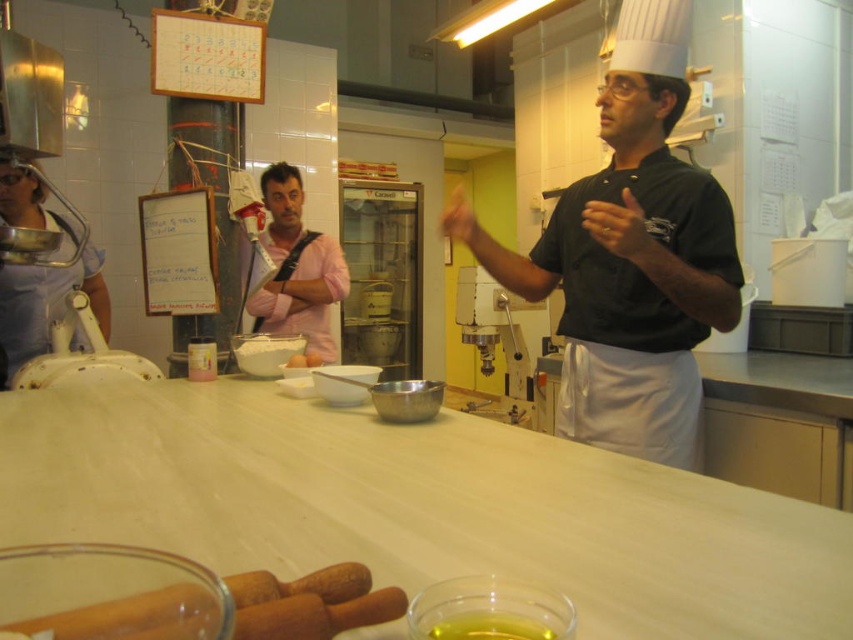
Is black matte chef's jacket at center above yellow matte hand at center?

Incorrect, black matte chef's jacket at center is not positioned above yellow matte hand at center.

Which is in front, point (587, 392) or point (477, 227)?

Point (587, 392) is in front.

Locate an element on the screen. The image size is (853, 640). black matte chef's jacket at center is located at coordinates 633,282.

At what (x,y) coordinates should I click in order to perform the action: click on black matte chef's jacket at center. Please return your answer as a coordinate pair (x, y). Image resolution: width=853 pixels, height=640 pixels. Looking at the image, I should click on (633, 282).

Who is more distant from viewer, (566,554) or (289,364)?

The point (289,364) is behind.

The height and width of the screenshot is (640, 853). Identify the location of white matte counter at center. (419, 508).

Does point (741, 540) come farther from viewer compared to point (292, 364)?

No, it is not.

You are a GUI agent. You are given a task and a screenshot of the screen. Output one action in this format:
    pyautogui.click(x=<x>, y=<y>)
    Task: Click on the white matte counter at center
    
    Given the screenshot: What is the action you would take?
    pyautogui.click(x=419, y=508)

From the picture: Can you confirm if black matte chef's jacket at center is wider than white matte bowl at center?

Yes.

Who is more distant from viewer, (605, 99) or (289, 358)?

Positioned behind is point (289, 358).

Is point (689, 429) closer to camera compared to point (318, 358)?

Yes, point (689, 429) is in front of point (318, 358).

This screenshot has width=853, height=640. Identify the location of black matte chef's jacket at center. (633, 282).